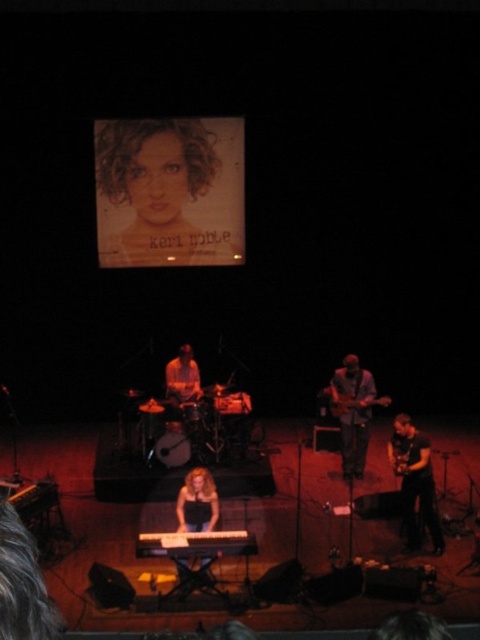
Based on the photo, based on the stage setup, where is the curly hair at upper center located in terms of coordinates?

The curly hair at upper center is located at coordinates point (169, 192).

Based on the scene description, which object has a greater width when comparing the curly hair at upper center and the matte brown guitar at center?

The curly hair at upper center has a greater width than the matte brown guitar at center.

You are a stagehand needing to move a 2.5 meter long ladder from the back of the stage to the front. The ladder must pass between the curly hair at upper center and the matte brown guitar at center. Is there enough space for the ladder to fit through this gap?

The distance between the curly hair at upper center and the matte brown guitar at center is 2.72 meters, which is slightly wider than the 2.5 meter ladder. Therefore, the ladder can fit through the gap between them.